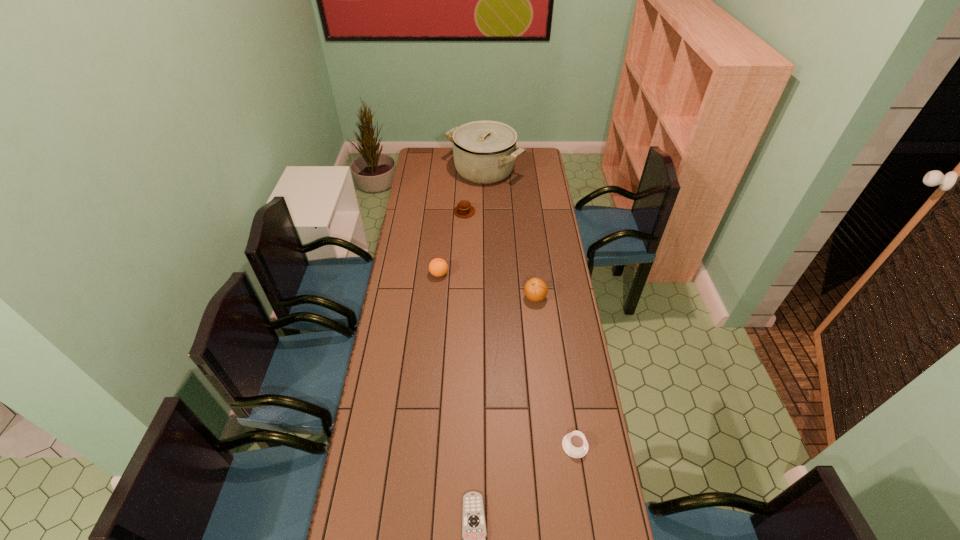
Locate an element on the screen. This screenshot has width=960, height=540. unoccupied area between the shorter orange and the second shortest object is located at coordinates (507, 360).

The width and height of the screenshot is (960, 540). Find the location of `free spot between the saucepan and the second farthest object`. free spot between the saucepan and the second farthest object is located at coordinates (474, 191).

In order to click on free space between the fourth shortest object and the teacup in this screenshot , I will do `click(507, 360)`.

I want to click on the fifth closest object to the second farthest object, so click(474, 532).

This screenshot has height=540, width=960. In order to click on the fourth closest object to the second farthest object in this screenshot , I will do `click(574, 444)`.

This screenshot has width=960, height=540. Identify the location of vacant space that satisfies the following two spatial constraints: 1. on the back side of the saucepan; 2. on the left side of the fifth nearest object. (x=466, y=171).

Identify the location of free space in the image that satisfies the following two spatial constraints: 1. on the back side of the farthest object; 2. on the right side of the third farthest object. Image resolution: width=960 pixels, height=540 pixels. (448, 171).